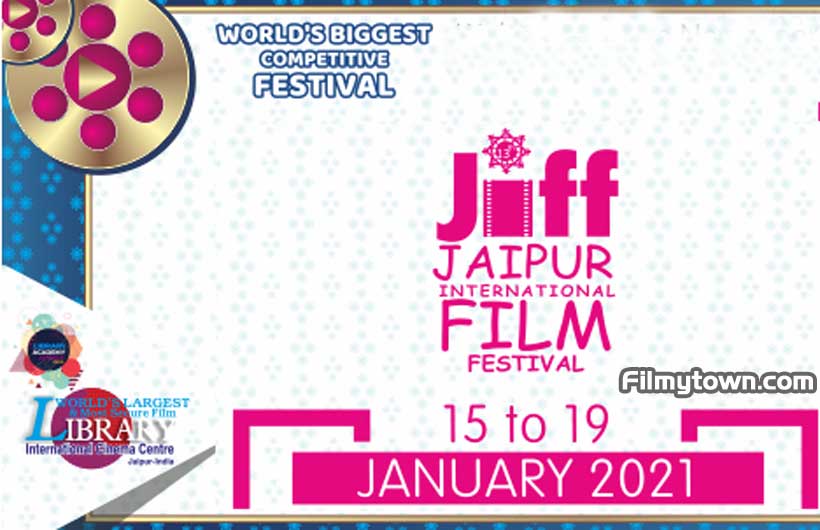
You are a GUI agent. You are given a task and a screenshot of the screen. Output one action in this format:
    pyautogui.click(x=<x>, y=<y>)
    Task: Click on the library
    The width and height of the screenshot is (820, 530).
    Given the screenshot: What is the action you would take?
    pyautogui.click(x=89, y=423)